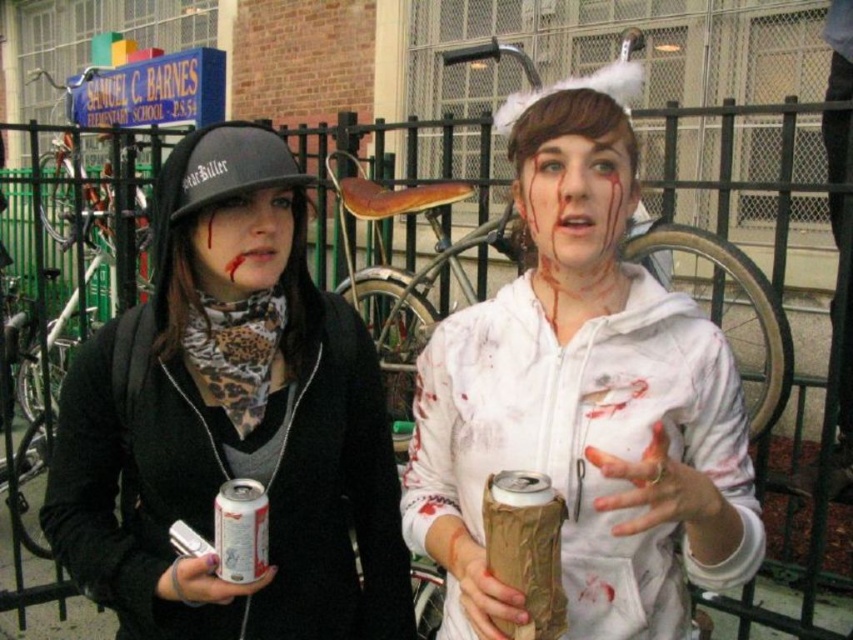
You are a photographer trying to capture a closeup shot of the brown paper wrapped can at center. The camera you are using has a minimum focusing distance of 36 inches. Based on the scene description, will you be able to take the closeup without moving closer?

The brown paper wrapped can at center is 35.56 inches from camera, which is closer than the camera minimum focusing distance of 36 inches. Therefore, you cannot take the closeup without moving closer.

You are a participant in the zombie walk and need to choose a drink to carry. You have a brown paper wrapped can at center and a silver metallic can at center. Which one can you carry without it being too small for your costume?

The brown paper wrapped can at center is larger in size than the silver metallic can at center, so you should choose the brown paper wrapped can at center as it is bigger and better suited for your costume.